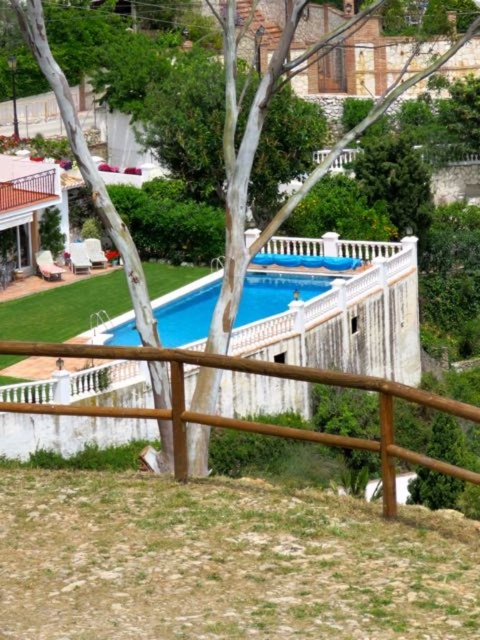
Is brown wooden fence at center further to the viewer compared to blue smooth pool at center?

No, it is not.

Can you confirm if brown wooden fence at center is positioned to the right of blue smooth pool at center?

Indeed, brown wooden fence at center is positioned on the right side of blue smooth pool at center.

The width and height of the screenshot is (480, 640). I want to click on brown wooden fence at center, so (x=250, y=420).